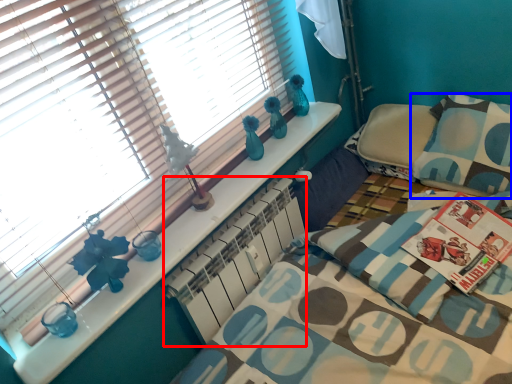
Question: Which point is closer to the camera, radiator (highlighted by a red box) or pillow (highlighted by a blue box)?

Choices:
 (A) radiator
 (B) pillow

Answer: (A)